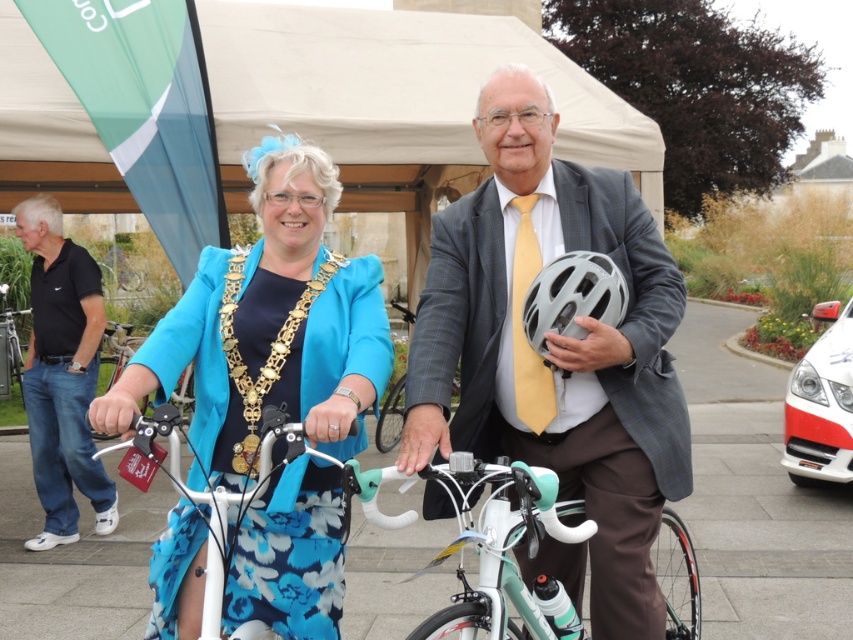
You are a photographer trying to capture a closeup of the black cotton polo shirt at left. Based on its position coordinates, where should you aim your camera relative to the woman and the man?

The black cotton polo shirt at left is located at point (62, 374), which means it is positioned slightly to the left and lower down on the image. To capture a closeup, aim your camera towards the lower left area near the woman since she is on the left side of the image.

You are a photographer standing at the origin point of the coordinate system. You want to take a photo of the white glossy bicycle at center. According to the coordinates provided, where should you position your camera relative to the bicycle to capture it in the frame?

The white glossy bicycle at center is located at coordinates point (252, 541). To capture it in the frame, the photographer should position the camera so that the bicycle is centered at those coordinates.

You are an architect designing a new public space and need to determine the best location for a bench. You have two options marked by points in the image. The first point is at coordinate point(521, 358) and the second is at point(320, 196). Based on their positions relative to the viewer, which point would be more suitable for placing the bench so it is closer to the foreground?

Point(521, 358) is further to the viewer than point(320, 196), so placing the bench at point(521, 358) would position it closer to the foreground.